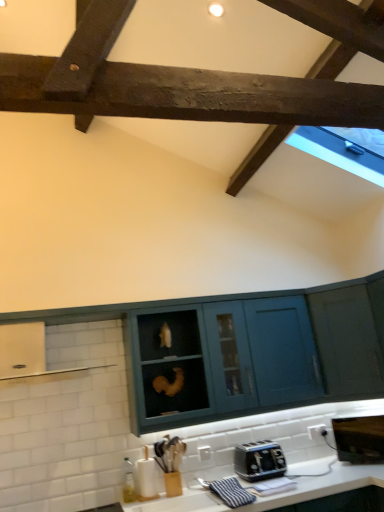
Question: From the image's perspective, is white glossy countertop at lower center located above or below black metallic toaster at lower center?

Choices:
 (A) below
 (B) above

Answer: (A)

Question: Would you say white glossy countertop at lower center is inside or outside black metallic toaster at lower center?

Choices:
 (A) inside
 (B) outside

Answer: (B)

Question: Considering the real-world distances, which object is closest to the white glossy countertop at lower center?

Choices:
 (A) black metallic toaster at lower center
 (B) black metallic microwave at lower right
 (C) teal matte cabinet at right, arranged as the 1th cabinetry when viewed from the right
 (D) teal matte cabinet at center, arranged as the first cabinetry when viewed from the left
 (E) teal matte cabinet at center, which is the second cabinetry from left to right

Answer: (A)

Question: Which of these objects is positioned farthest from the teal matte cabinet at center, positioned as the 3th cabinetry in right-to-left order?

Choices:
 (A) teal matte cabinet at center, which is the second cabinetry from left to right
 (B) white glossy exhaust hood at left
 (C) teal matte cabinet at right, arranged as the 1th cabinetry when viewed from the right
 (D) white glossy countertop at lower center
 (E) black metallic microwave at lower right

Answer: (D)